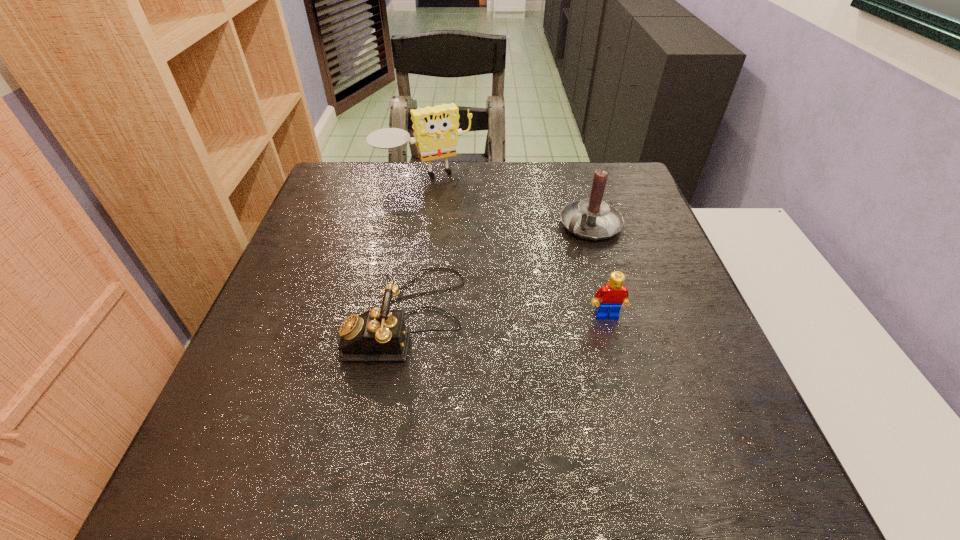
Identify the location of telephone. click(x=379, y=334).

At what (x,y) coordinates should I click in order to perform the action: click on Lego. Please return your answer as a coordinate pair (x, y). The image size is (960, 540). Looking at the image, I should click on pyautogui.click(x=613, y=295).

The image size is (960, 540). In order to click on candle in this screenshot , I will do `click(594, 219)`.

This screenshot has height=540, width=960. I want to click on the second tallest object, so (594, 219).

Locate an element on the screen. The width and height of the screenshot is (960, 540). sponge is located at coordinates (436, 132).

Locate an element on the screen. the farthest object is located at coordinates (436, 132).

Image resolution: width=960 pixels, height=540 pixels. What are the coordinates of `vacant point located on the dial of the telephone` in the screenshot? It's located at (313, 317).

Where is `vacant space situated 0.110m on the dial of the telephone`? vacant space situated 0.110m on the dial of the telephone is located at coordinates (299, 317).

Find the location of a particular element. vacant space located on the dial of the telephone is located at coordinates (313, 317).

At what (x,y) coordinates should I click in order to perform the action: click on vacant region located 0.200m on the front-facing side of the Lego. Please return your answer as a coordinate pair (x, y). This screenshot has width=960, height=540. Looking at the image, I should click on (633, 410).